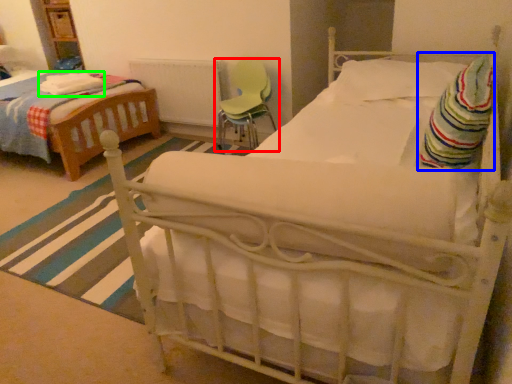
Question: Which object is the closest to the chair (highlighted by a red box)? Choose among these: blanket (highlighted by a blue box) or blanket (highlighted by a green box).

Choices:
 (A) blanket
 (B) blanket

Answer: (B)